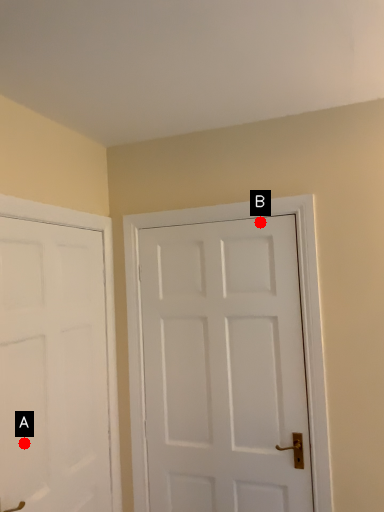
Question: Two points are circled on the image, labeled by A and B beside each circle. Among these points, which one is farthest from the camera?

Choices:
 (A) A is further
 (B) B is further

Answer: (B)